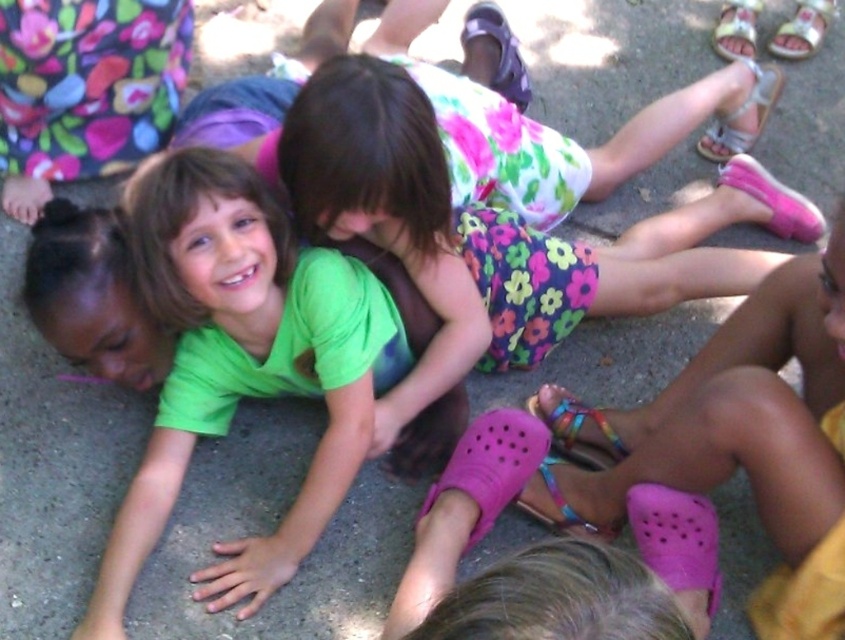
Question: Which of these objects is positioned farthest from the multicolored woven sandal at lower center?

Choices:
 (A) purple fabric sandal at upper center
 (B) pink fabric sandal at lower right
 (C) yellow fabric sandal at upper right
 (D) pink fabric sandal at lower center

Answer: (C)

Question: Is pink fabric sandal at lower right bigger than pink fabric sandal at lower center?

Choices:
 (A) yes
 (B) no

Answer: (A)

Question: Can you confirm if pink croc sandal at lower center is positioned above metallic silver sandal at upper right?

Choices:
 (A) yes
 (B) no

Answer: (B)

Question: Among these points, which one is nearest to the camera?

Choices:
 (A) (366, 365)
 (B) (729, 26)

Answer: (A)

Question: In this image, where is pink croc sandal at lower center located relative to pink fabric sandal at lower right?

Choices:
 (A) right
 (B) left

Answer: (B)

Question: Which point is closer to the camera?

Choices:
 (A) [x=649, y=502]
 (B) [x=745, y=170]
 (C) [x=822, y=19]
 (D) [x=559, y=412]

Answer: (A)